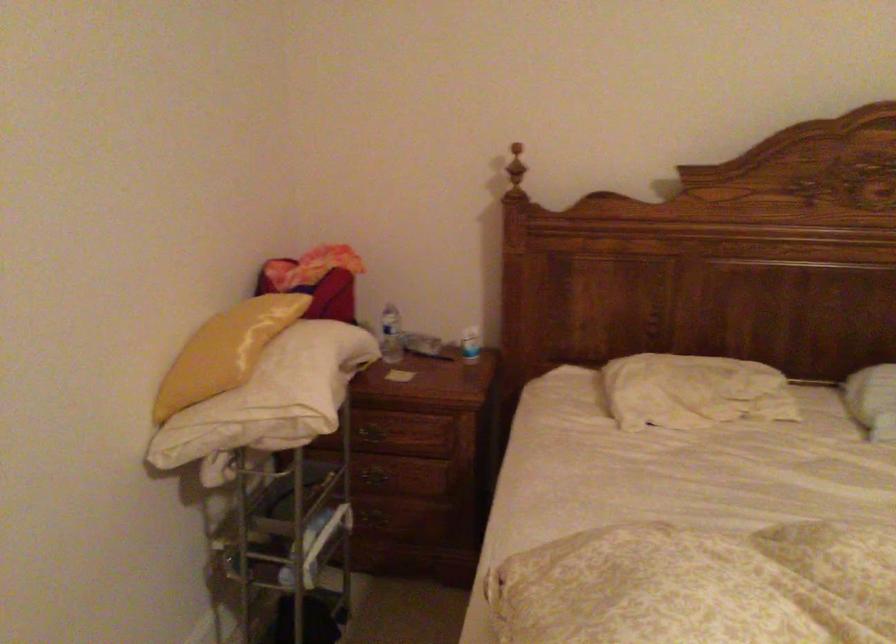
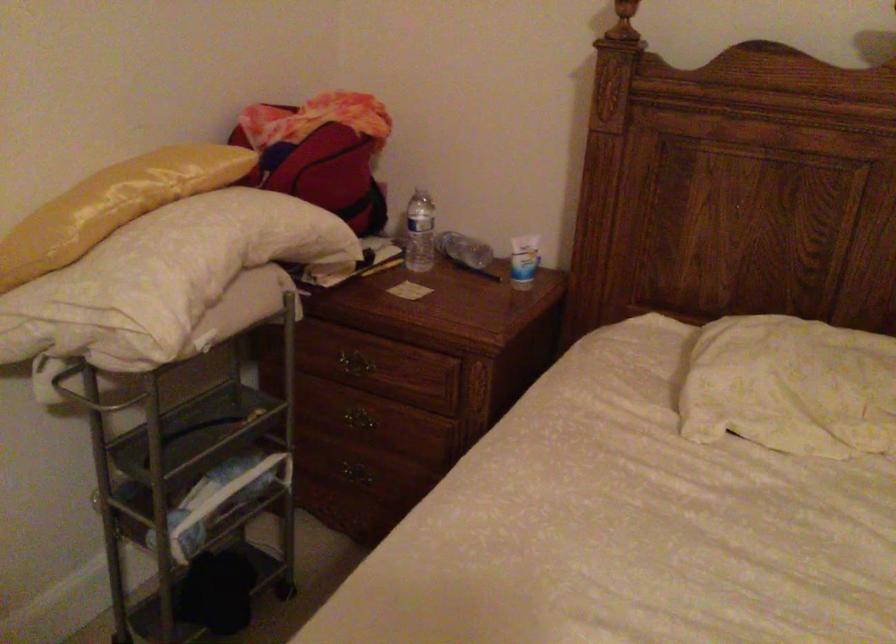
Where in the second image is the point corresponding to (x=398, y=334) from the first image?

(419, 232)